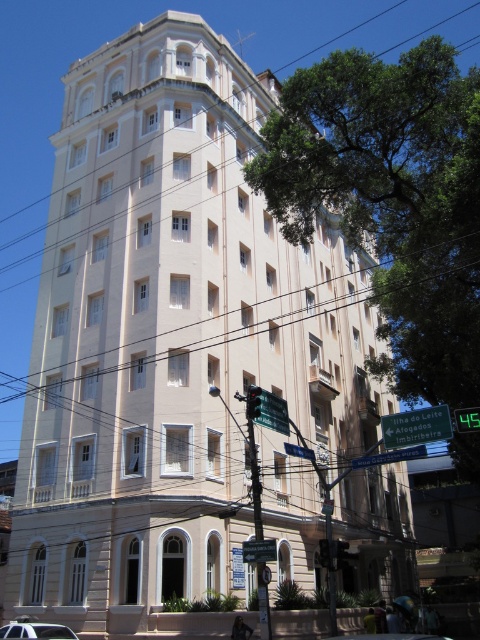
Which is in front, point (55, 628) or point (344, 637)?

Point (55, 628) is more forward.

Find the location of `metallic silver car at lower left`. metallic silver car at lower left is located at coordinates coord(36,630).

This screenshot has width=480, height=640. Describe the element at coordinates (36, 630) in the screenshot. I see `metallic silver car at lower left` at that location.

Image resolution: width=480 pixels, height=640 pixels. I want to click on metallic silver car at lower left, so click(x=36, y=630).

Can you confirm if green plastic sign at center is wider than green plastic street sign at center?

No.

Is point (450, 433) farther from camera compared to point (392, 458)?

That is False.

The height and width of the screenshot is (640, 480). In order to click on green plastic sign at center in this screenshot , I will do `click(416, 426)`.

Who is positioned more to the right, green plastic sign at center or metallic silver car at lower left?

green plastic sign at center

Can you confirm if green plastic sign at center is bigger than metallic silver car at lower left?

No, green plastic sign at center is not bigger than metallic silver car at lower left.

At what (x,y) coordinates should I click in order to perform the action: click on green plastic sign at center. Please return your answer as a coordinate pair (x, y). Looking at the image, I should click on (416, 426).